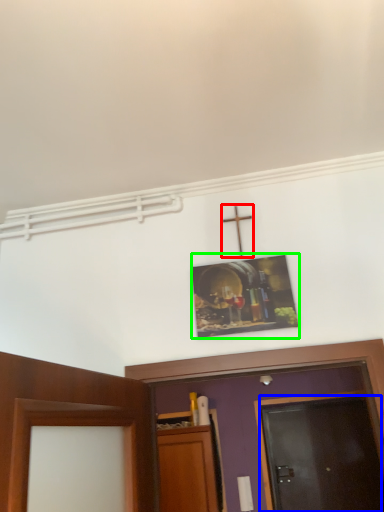
Question: Based on their relative distances, which object is farther from crucifix (highlighted by a red box)? Choose from door (highlighted by a blue box) and picture frame (highlighted by a green box).

Choices:
 (A) door
 (B) picture frame

Answer: (A)